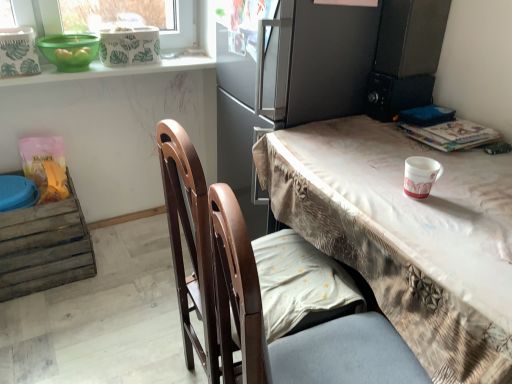
Question: Is green plastic bowl at upper left facing towards weathered wood crate at lower left?

Choices:
 (A) yes
 (B) no

Answer: (B)

Question: Is green plastic bowl at upper left facing away from weathered wood crate at lower left?

Choices:
 (A) yes
 (B) no

Answer: (B)

Question: From a real-world perspective, is green plastic bowl at upper left on top of weathered wood crate at lower left?

Choices:
 (A) no
 (B) yes

Answer: (B)

Question: Does green plastic bowl at upper left lie behind weathered wood crate at lower left?

Choices:
 (A) yes
 (B) no

Answer: (B)

Question: Is green plastic bowl at upper left surrounding weathered wood crate at lower left?

Choices:
 (A) yes
 (B) no

Answer: (B)

Question: Can you confirm if green plastic bowl at upper left is thinner than weathered wood crate at lower left?

Choices:
 (A) yes
 (B) no

Answer: (A)

Question: Can you confirm if hardcover book at upper right is thinner than weathered wood crate at lower left?

Choices:
 (A) yes
 (B) no

Answer: (A)

Question: Is hardcover book at upper right taller than weathered wood crate at lower left?

Choices:
 (A) no
 (B) yes

Answer: (A)

Question: Can you confirm if hardcover book at upper right is wider than weathered wood crate at lower left?

Choices:
 (A) no
 (B) yes

Answer: (A)

Question: Is hardcover book at upper right looking in the opposite direction of weathered wood crate at lower left?

Choices:
 (A) no
 (B) yes

Answer: (A)

Question: Does hardcover book at upper right have a lesser height compared to weathered wood crate at lower left?

Choices:
 (A) no
 (B) yes

Answer: (B)

Question: Does hardcover book at upper right turn towards weathered wood crate at lower left?

Choices:
 (A) yes
 (B) no

Answer: (B)

Question: Is white paper cup at right placed right next to green plastic bowl at upper left?

Choices:
 (A) yes
 (B) no

Answer: (B)